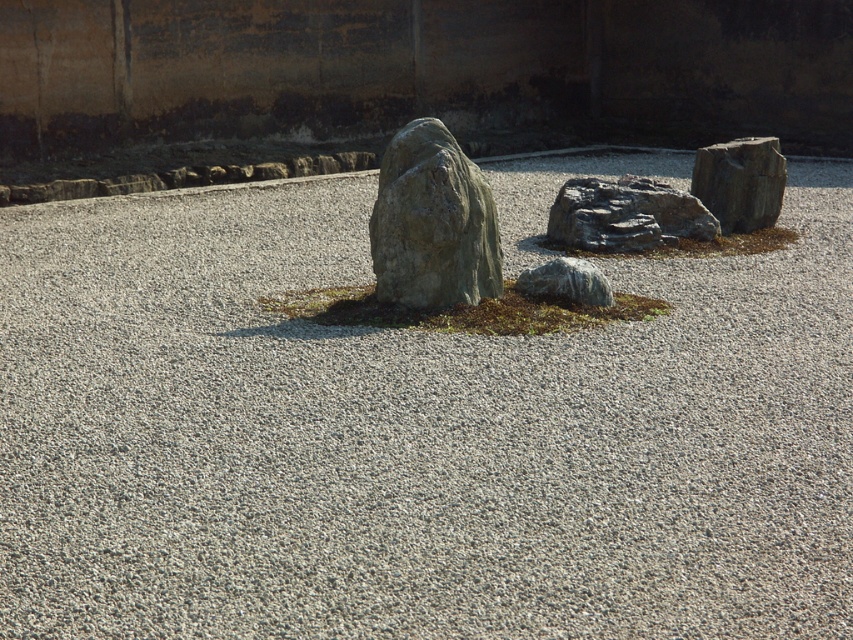
You are standing in the garden and want to place a small potted plant between the rough gray rock at center and the smooth gray rock at right. Based on their positions, which rock should you start from to ensure the plant is placed correctly?

You should start from the rough gray rock at center because it is positioned to the left of the smooth gray rock at right, so placing the plant between them would require starting from the left rock first.

Consider the image. You are designing a garden layout and need to place a small decorative item between the gray rough stone at center and the gray rough rock at center. Which object should the item be placed closer to if you want it to be proportionally balanced?

The gray rough stone at center is bigger than the gray rough rock at center, so to achieve proportional balance, the decorative item should be placed closer to the smaller gray rough rock at center to compensate for the size difference.